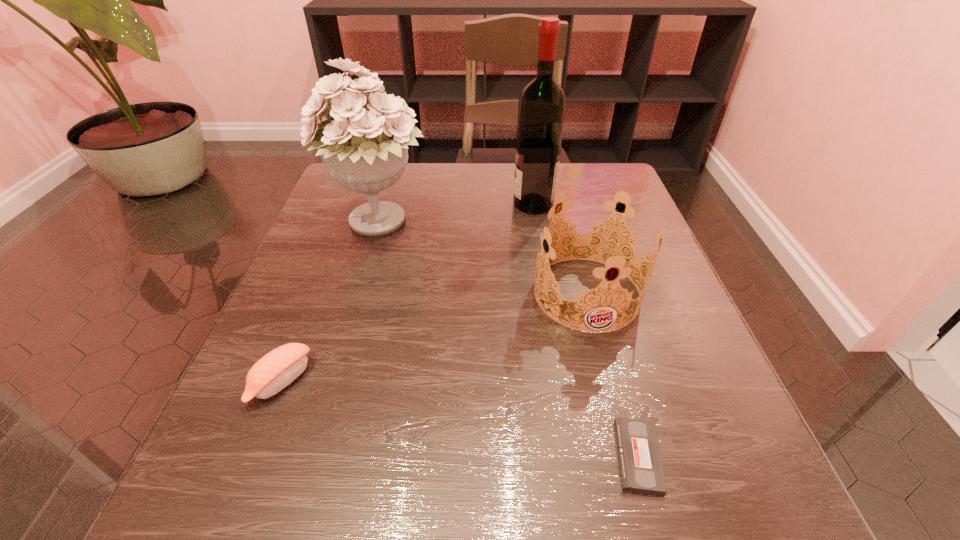
At what (x,y) coordinates should I click in order to perform the action: click on crown at the right edge. Please return your answer as a coordinate pair (x, y). The width and height of the screenshot is (960, 540). Looking at the image, I should click on (598, 246).

At what (x,y) coordinates should I click in order to perform the action: click on videotape at the right edge. Please return your answer as a coordinate pair (x, y). Looking at the image, I should click on (641, 471).

Where is `object that is at the far left corner`? The height and width of the screenshot is (540, 960). object that is at the far left corner is located at coordinates point(364,150).

The image size is (960, 540). Find the location of `object that is positioned at the near right corner`. object that is positioned at the near right corner is located at coordinates (641, 471).

Locate an element on the screen. Image resolution: width=960 pixels, height=540 pixels. free spot at the near edge of the desktop is located at coordinates pyautogui.click(x=370, y=497).

Where is `vacant space at the left edge of the desktop`? vacant space at the left edge of the desktop is located at coordinates (349, 298).

At what (x,y) coordinates should I click in order to perform the action: click on free location at the right edge. Please return your answer as a coordinate pair (x, y). Looking at the image, I should click on (686, 432).

The width and height of the screenshot is (960, 540). In the image, there is a desktop. Find the location of `free space at the near left corner`. free space at the near left corner is located at coordinates (246, 467).

Find the location of a particular element. The image size is (960, 540). blank area at the near right corner is located at coordinates (718, 516).

The height and width of the screenshot is (540, 960). Identify the location of free area in between the fourth farthest object and the nearest object. (460, 419).